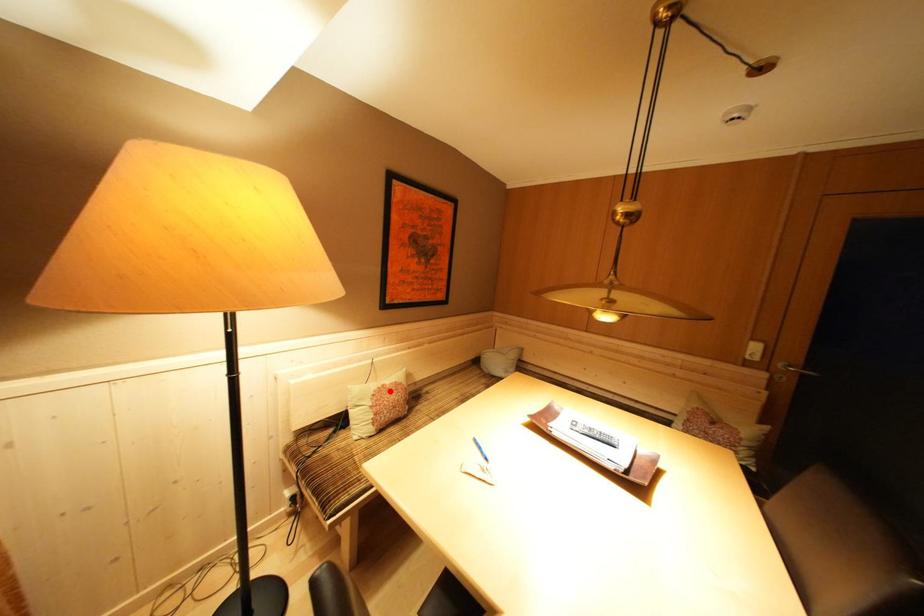
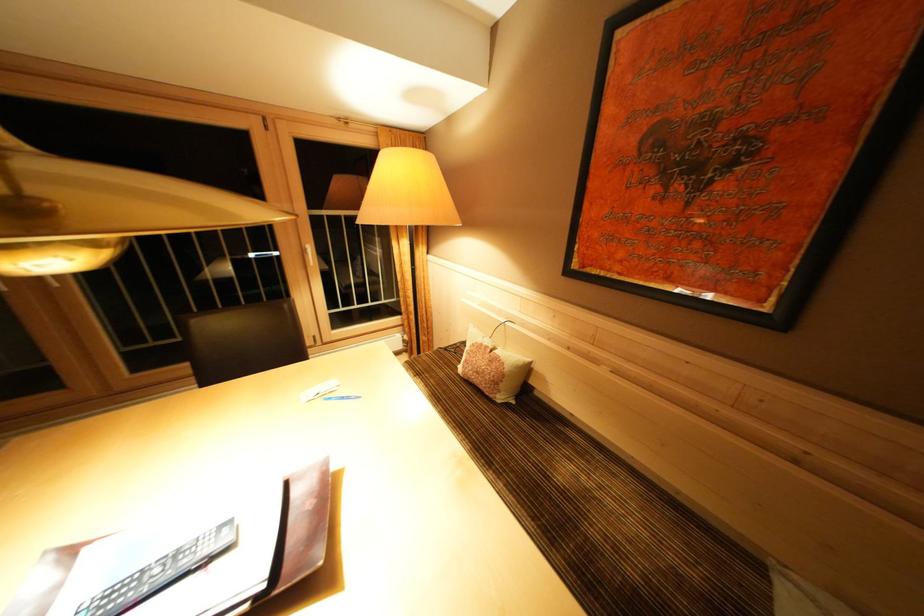
The point at the highlighted location is marked in the first image. Where is the corresponding point in the second image?

(493, 352)